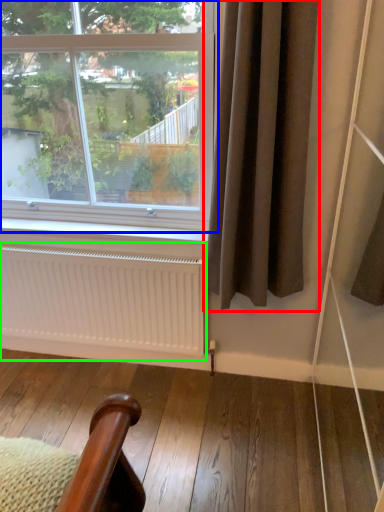
Question: Which object is the closest to the curtain (highlighted by a red box)? Choose among these: window (highlighted by a blue box) or radiator (highlighted by a green box).

Choices:
 (A) window
 (B) radiator

Answer: (B)